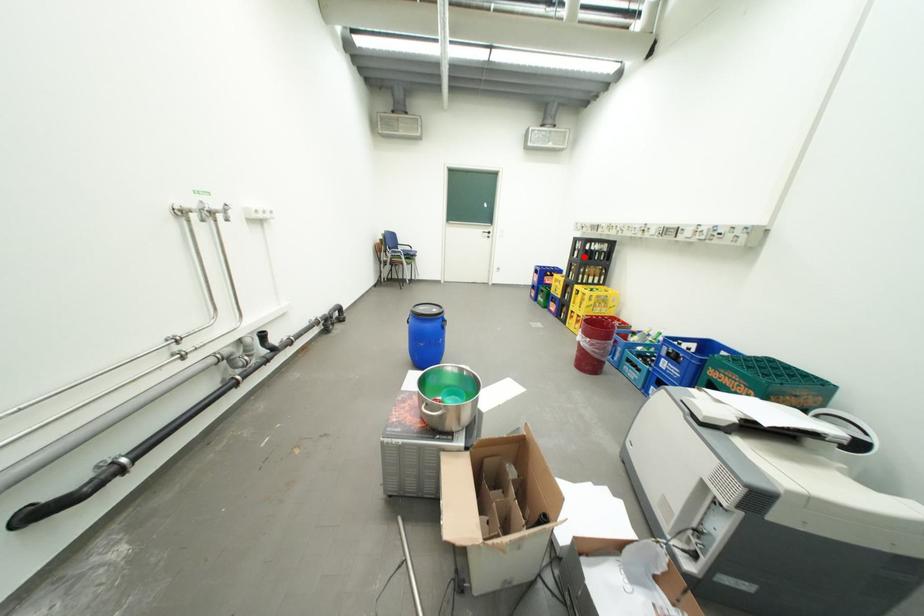
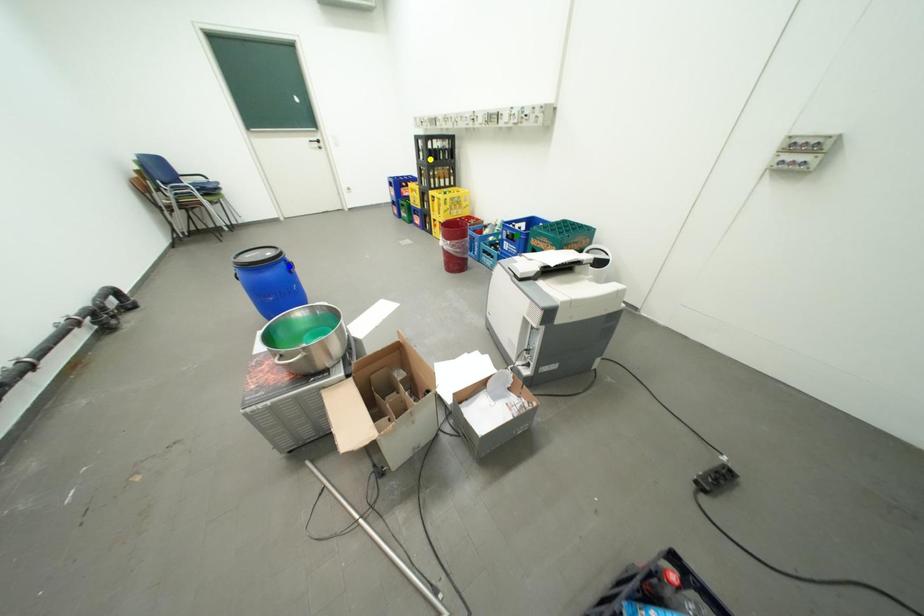
Question: I am providing you with two images of the same scene from different viewpoints. A red point is marked on the first image. You are given multiple points on the second image. Can you choose the point in image 2 that corresponds to the point in image 1?

Choices:
 (A) green point
 (B) yellow point
 (C) blue point

Answer: (B)